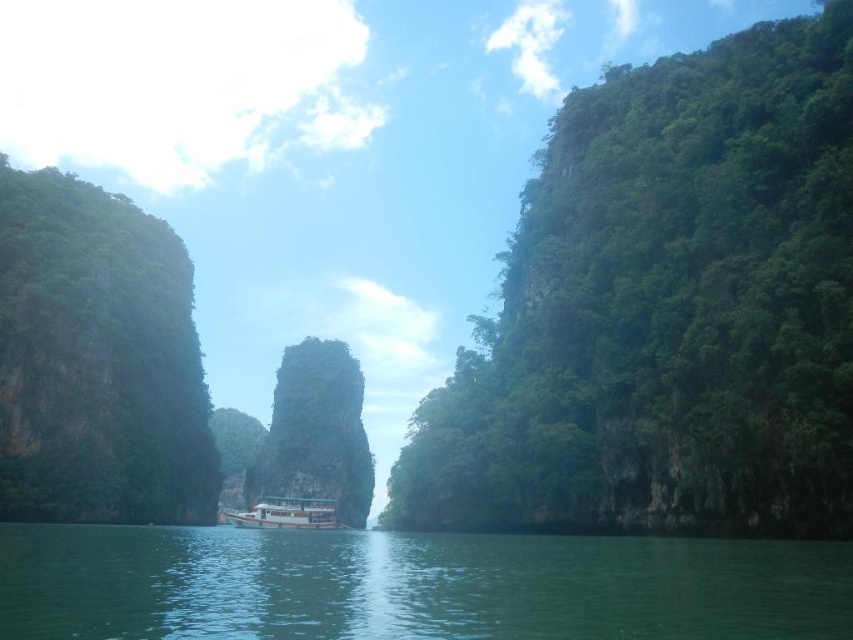
Question: Does green smooth water at center have a lesser width compared to white matte boat at center?

Choices:
 (A) yes
 (B) no

Answer: (B)

Question: Is green smooth water at center bigger than white matte boat at center?

Choices:
 (A) no
 (B) yes

Answer: (B)

Question: Can you confirm if green smooth water at center is positioned above white matte boat at center?

Choices:
 (A) no
 (B) yes

Answer: (B)

Question: Estimate the real-world distances between objects in this image. Which object is closer to the green smooth water at center?

Choices:
 (A) white matte boat at center
 (B) rusty stone rock at center

Answer: (A)

Question: Based on their relative distances, which object is nearer to the white matte boat at center?

Choices:
 (A) green smooth water at center
 (B) rusty stone rock at center

Answer: (B)

Question: Which is nearer to the white matte boat at center?

Choices:
 (A) green smooth water at center
 (B) rusty stone rock at center

Answer: (B)